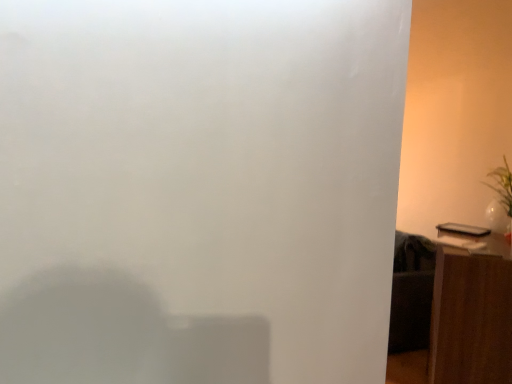
Question: Does white glossy vase at right have a smaller size compared to brown wood side table at right?

Choices:
 (A) no
 (B) yes

Answer: (B)

Question: Is the surface of white glossy vase at right in direct contact with brown wood side table at right?

Choices:
 (A) yes
 (B) no

Answer: (B)

Question: Is white glossy vase at right bigger than brown wood side table at right?

Choices:
 (A) yes
 (B) no

Answer: (B)

Question: Is white glossy vase at right positioned far away from brown wood side table at right?

Choices:
 (A) no
 (B) yes

Answer: (A)

Question: Is white glossy vase at right to the right of brown wood side table at right from the viewer's perspective?

Choices:
 (A) no
 (B) yes

Answer: (B)

Question: Can brown wood side table at right be found inside white glossy vase at right?

Choices:
 (A) no
 (B) yes

Answer: (A)

Question: Considering the relative sizes of brown wood side table at right and white glossy vase at right in the image provided, is brown wood side table at right taller than white glossy vase at right?

Choices:
 (A) no
 (B) yes

Answer: (B)

Question: Can you confirm if brown wood side table at right is shorter than white glossy vase at right?

Choices:
 (A) yes
 (B) no

Answer: (B)

Question: Could you tell me if brown wood side table at right is facing white glossy vase at right?

Choices:
 (A) no
 (B) yes

Answer: (A)

Question: Can you confirm if brown wood side table at right is positioned to the right of white glossy vase at right?

Choices:
 (A) no
 (B) yes

Answer: (A)

Question: Is the position of brown wood side table at right more distant than that of white glossy vase at right?

Choices:
 (A) no
 (B) yes

Answer: (A)

Question: Is brown wood side table at right completely or partially outside of white glossy vase at right?

Choices:
 (A) no
 (B) yes

Answer: (B)

Question: Considering the positions of point (502, 205) and point (463, 317), is point (502, 205) closer or farther from the camera than point (463, 317)?

Choices:
 (A) closer
 (B) farther

Answer: (B)